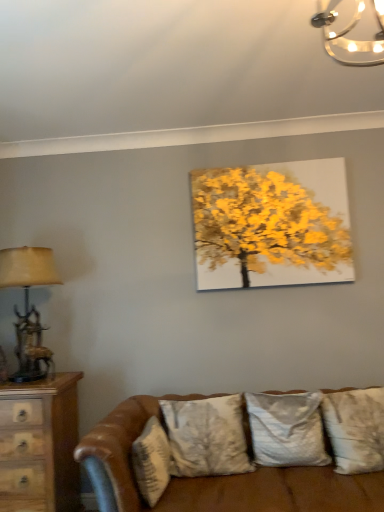
Question: Considering the relative positions of silky white pillow at center, the 2th pillow viewed from the left, and metallic glass chandelier at upper right in the image provided, is silky white pillow at center, the 2th pillow viewed from the left, to the left of metallic glass chandelier at upper right from the viewer's perspective?

Choices:
 (A) no
 (B) yes

Answer: (B)

Question: Is silky white pillow at center, the third pillow viewed from the right, further to camera compared to metallic glass chandelier at upper right?

Choices:
 (A) no
 (B) yes

Answer: (B)

Question: Is silky white pillow at center, the third pillow viewed from the right, positioned in front of metallic glass chandelier at upper right?

Choices:
 (A) no
 (B) yes

Answer: (A)

Question: Is silky white pillow at center, the third pillow viewed from the right, touching metallic glass chandelier at upper right?

Choices:
 (A) no
 (B) yes

Answer: (A)

Question: Can you confirm if silky white pillow at center, the third pillow viewed from the right, is positioned to the right of metallic glass chandelier at upper right?

Choices:
 (A) no
 (B) yes

Answer: (A)

Question: Does point (347, 394) appear closer or farther from the camera than point (316, 436)?

Choices:
 (A) farther
 (B) closer

Answer: (A)

Question: Based on their positions, is textured beige pillow at lower right, the 1th pillow when ordered from right to left, located to the left or right of silky gray pillow at center, marked as the second pillow in a right-to-left arrangement?

Choices:
 (A) left
 (B) right

Answer: (B)

Question: From their relative heights in the image, would you say textured beige pillow at lower right, which is counted as the 4th pillow, starting from the left, is taller or shorter than silky gray pillow at center, which appears as the third pillow when viewed from the left?

Choices:
 (A) tall
 (B) short

Answer: (A)

Question: From a real-world perspective, is textured beige pillow at lower right, the 1th pillow when ordered from right to left, physically located above or below silky gray pillow at center, marked as the second pillow in a right-to-left arrangement?

Choices:
 (A) above
 (B) below

Answer: (B)

Question: Is point (365, 41) positioned closer to the camera than point (175, 408)?

Choices:
 (A) farther
 (B) closer

Answer: (B)

Question: Considering the positions of metallic glass chandelier at upper right and silky white pillow at center, the third pillow viewed from the right, in the image, is metallic glass chandelier at upper right bigger or smaller than silky white pillow at center, the third pillow viewed from the right,?

Choices:
 (A) small
 (B) big

Answer: (A)

Question: Is metallic glass chandelier at upper right taller or shorter than silky white pillow at center, the 2th pillow viewed from the left?

Choices:
 (A) short
 (B) tall

Answer: (A)

Question: From the image's perspective, is metallic glass chandelier at upper right located above or below silky white pillow at center, the third pillow viewed from the right?

Choices:
 (A) above
 (B) below

Answer: (A)

Question: In the image, is silky white pillow at center, the third pillow viewed from the right, positioned in front of or behind brown leather couch at lower center?

Choices:
 (A) behind
 (B) front

Answer: (A)

Question: Is silky white pillow at center, the 2th pillow viewed from the left, wider or thinner than brown leather couch at lower center?

Choices:
 (A) thin
 (B) wide

Answer: (A)